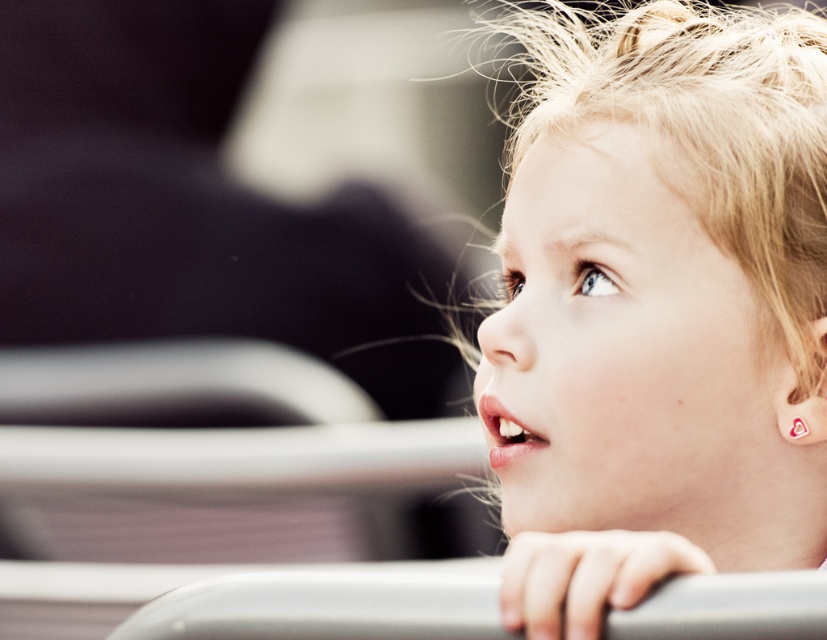
Does point (590, 566) lie in front of point (201, 627)?

Yes, it is.

The height and width of the screenshot is (640, 827). What do you see at coordinates (658, 307) in the screenshot?
I see `pale blonde hair at upper right` at bounding box center [658, 307].

At what (x,y) coordinates should I click in order to perform the action: click on pale blonde hair at upper right. Please return your answer as a coordinate pair (x, y). The height and width of the screenshot is (640, 827). Looking at the image, I should click on (658, 307).